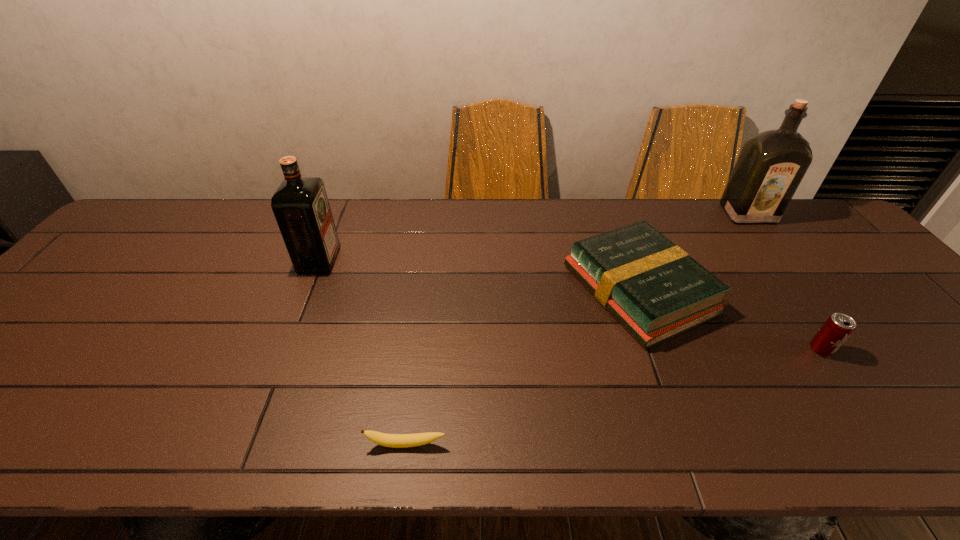
You are a GUI agent. You are given a task and a screenshot of the screen. Output one action in this format:
    pyautogui.click(x=<x>, y=<y>)
    Task: Click on the right liquor
    Image resolution: width=960 pixels, height=540 pixels.
    Given the screenshot: What is the action you would take?
    pyautogui.click(x=771, y=165)

Locate an element on the screen. the farther liquor is located at coordinates (771, 165).

At what (x,y) coordinates should I click in order to perform the action: click on the left liquor. Please return your answer as a coordinate pair (x, y). Looking at the image, I should click on (300, 205).

The width and height of the screenshot is (960, 540). Identify the location of the leftmost object. (300, 205).

Find the location of a particular element. The width and height of the screenshot is (960, 540). beer can is located at coordinates (838, 327).

At what (x,y) coordinates should I click in order to perform the action: click on the third object from left to right. Please return your answer as a coordinate pair (x, y). The image size is (960, 540). Looking at the image, I should click on (653, 288).

I want to click on banana, so click(388, 440).

Image resolution: width=960 pixels, height=540 pixels. I want to click on the shortest object, so click(388, 440).

This screenshot has height=540, width=960. Find the location of `vacant space positioned 0.390m on the label of the farther liquor`. vacant space positioned 0.390m on the label of the farther liquor is located at coordinates (828, 319).

You are a GUI agent. You are given a task and a screenshot of the screen. Output one action in this format:
    pyautogui.click(x=<x>, y=<y>)
    Task: Click on the vacant space situated 0.380m on the front label of the second tallest object
    The image size is (960, 540).
    Given the screenshot: What is the action you would take?
    pyautogui.click(x=469, y=260)